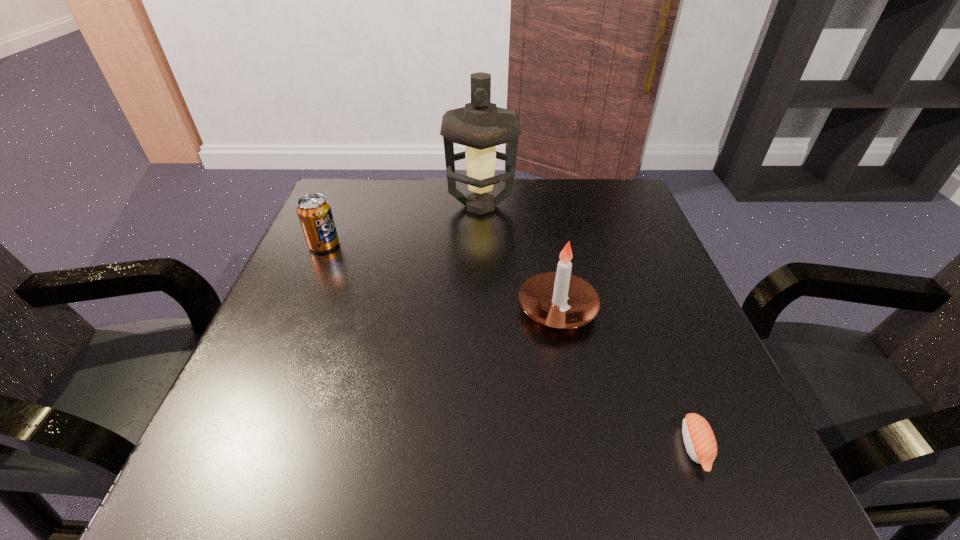
This screenshot has height=540, width=960. Identify the location of the farthest object. (480, 126).

In order to click on oil lamp in this screenshot , I will do `click(480, 126)`.

I want to click on the second nearest object, so click(x=559, y=299).

Locate an element on the screen. Image resolution: width=960 pixels, height=540 pixels. candle is located at coordinates (559, 299).

Identify the location of soda can. (314, 212).

Where is `the second farthest object`? The image size is (960, 540). the second farthest object is located at coordinates (314, 212).

Where is `the nearest object`? the nearest object is located at coordinates 699,439.

Where is `sushi`? The height and width of the screenshot is (540, 960). sushi is located at coordinates (699, 439).

This screenshot has width=960, height=540. Find the location of `free space located on the left of the oil lamp`. free space located on the left of the oil lamp is located at coordinates (427, 206).

Locate an element on the screen. The width and height of the screenshot is (960, 540). free space located 0.060m on the front of the second tallest object is located at coordinates (568, 366).